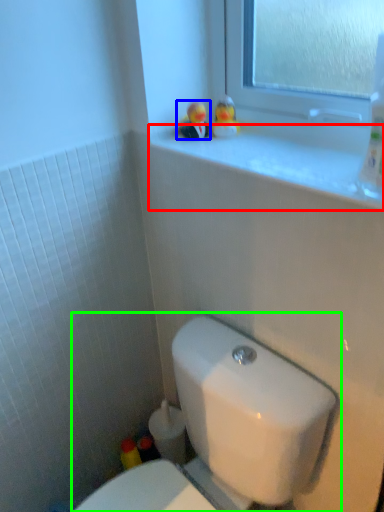
Question: Estimate the real-world distances between objects in this image. Which object is farther from window sill (highlighted by a red box), miniature (highlighted by a blue box) or toilet (highlighted by a green box)?

Choices:
 (A) miniature
 (B) toilet

Answer: (B)